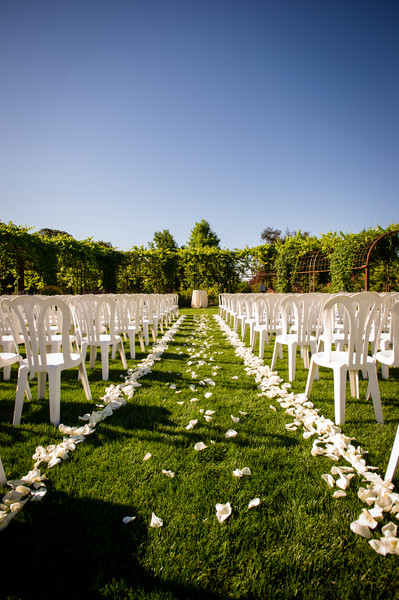
I want to click on section of chairs on the left side, so click(114, 335).